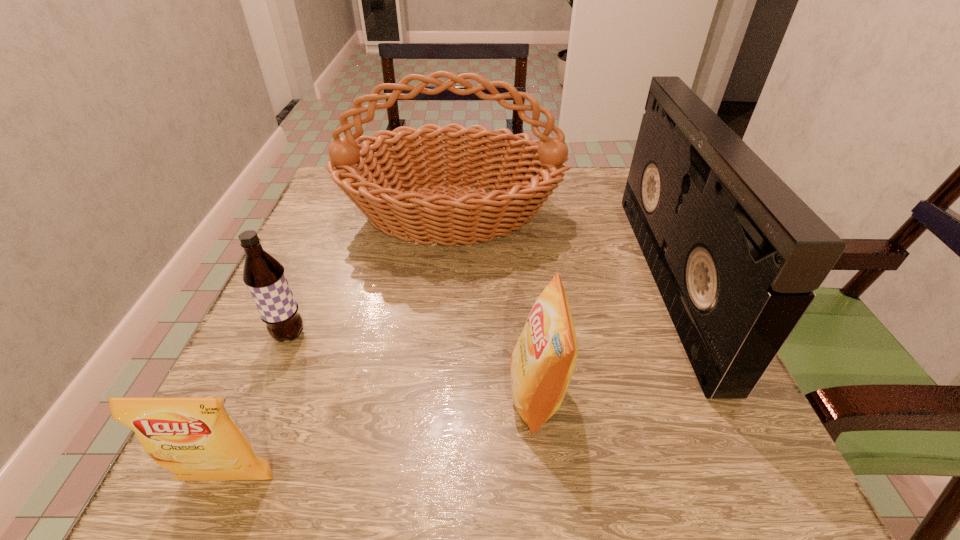
The height and width of the screenshot is (540, 960). I want to click on basket, so click(395, 197).

At what (x,y) coordinates should I click in order to perform the action: click on the rightmost object. Please return your answer as a coordinate pair (x, y). This screenshot has width=960, height=540. Looking at the image, I should click on (736, 254).

Locate an element on the screen. root beer is located at coordinates (264, 276).

This screenshot has height=540, width=960. Identify the location of the right crisp (potato chip). (542, 362).

Locate an element on the screen. This screenshot has height=540, width=960. the nearer crisp (potato chip) is located at coordinates (196, 438).

At what (x,y) coordinates should I click in order to perform the action: click on the left crisp (potato chip). Please return your answer as a coordinate pair (x, y). This screenshot has width=960, height=540. Looking at the image, I should click on (196, 438).

I want to click on free space located 0.050m on the right of the basket, so click(583, 215).

In order to click on vacant area located on the front side of the videotape in this screenshot , I will do `click(480, 280)`.

Locate an element on the screen. vacant region located 0.140m on the front side of the videotape is located at coordinates (583, 280).

This screenshot has width=960, height=540. I want to click on vacant space situated 0.200m on the front side of the videotape, so click(x=552, y=280).